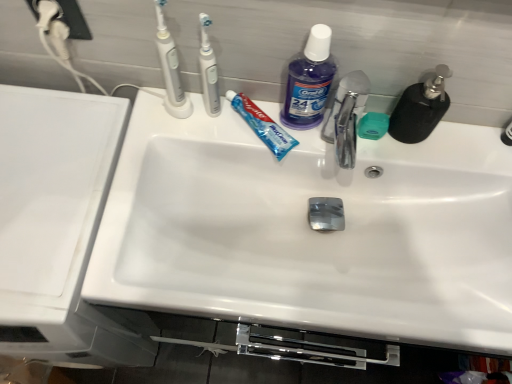
The image size is (512, 384). What are the coordinates of `vacant area that lies between white plastic toothbrush at upper left, placed as the 1th toothbrush when sorted from left to right, and blue glossy toothpaste at center` in the screenshot? It's located at (226, 129).